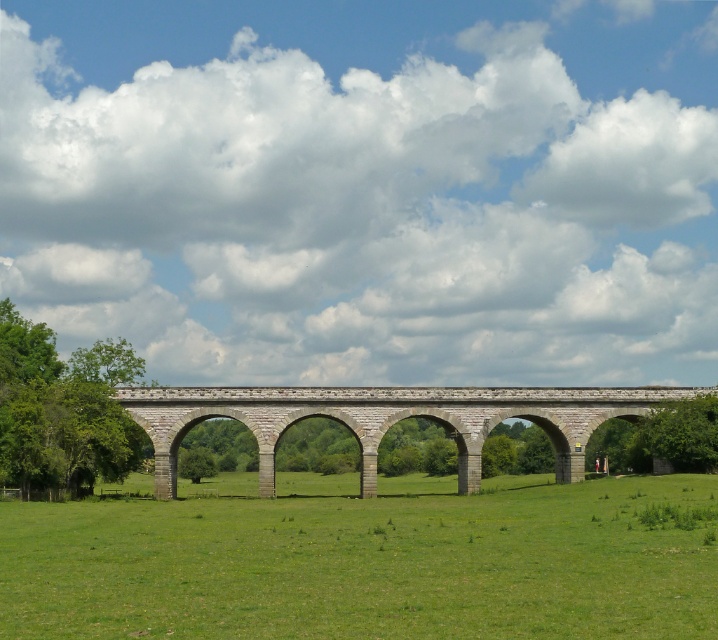
Question: Can you confirm if gray stone bridge at center is positioned below green leafy tree at left?

Choices:
 (A) no
 (B) yes

Answer: (B)

Question: Can you confirm if green grassy field at center is smaller than green leafy tree at center?

Choices:
 (A) no
 (B) yes

Answer: (A)

Question: Estimate the real-world distances between objects in this image. Which object is farther from the green grassy field at center?

Choices:
 (A) gray stone bridge at center
 (B) green leafy tree at center
 (C) green leafy tree at left

Answer: (C)

Question: Which point is farther from the camera taking this photo?

Choices:
 (A) (662, 452)
 (B) (97, 374)
 (C) (9, 582)
 (D) (607, 394)

Answer: (D)

Question: Which point is closer to the camera?

Choices:
 (A) green leafy tree at left
 (B) gray stone bridge at center
 (C) green leafy tree at center
 (D) green grassy field at center

Answer: (D)

Question: Does green grassy field at center come behind green leafy tree at center?

Choices:
 (A) no
 (B) yes

Answer: (A)